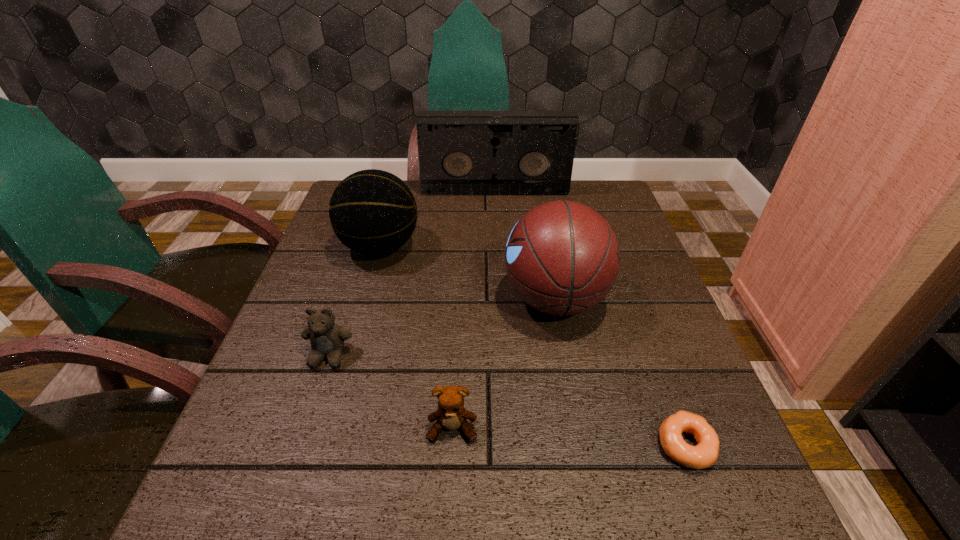
Identify the location of basketball located at the right edge. The width and height of the screenshot is (960, 540). (562, 257).

Find the location of a particular element. Image resolution: width=960 pixels, height=540 pixels. doughnut that is at the right edge is located at coordinates (703, 455).

Find the location of a particular element. The width and height of the screenshot is (960, 540). object at the far left corner is located at coordinates (373, 212).

You are a GUI agent. You are given a task and a screenshot of the screen. Output one action in this format:
    pyautogui.click(x=<x>, y=<y>)
    Task: Click on the object positioned at the far right corner
    The image size is (960, 540).
    Given the screenshot: What is the action you would take?
    pyautogui.click(x=460, y=152)

Image resolution: width=960 pixels, height=540 pixels. I want to click on vacant space at the far edge, so click(522, 198).

Where is `vacant space at the near edge`? This screenshot has width=960, height=540. vacant space at the near edge is located at coordinates (640, 507).

The height and width of the screenshot is (540, 960). I want to click on blank space at the left edge of the desktop, so click(348, 329).

The image size is (960, 540). In order to click on vacant space at the right edge of the desktop in this screenshot , I will do `click(658, 335)`.

Image resolution: width=960 pixels, height=540 pixels. I want to click on vacant point at the near left corner, so click(251, 508).

Identify the location of free space between the left basketball and the doughnut. The image size is (960, 540). (533, 346).